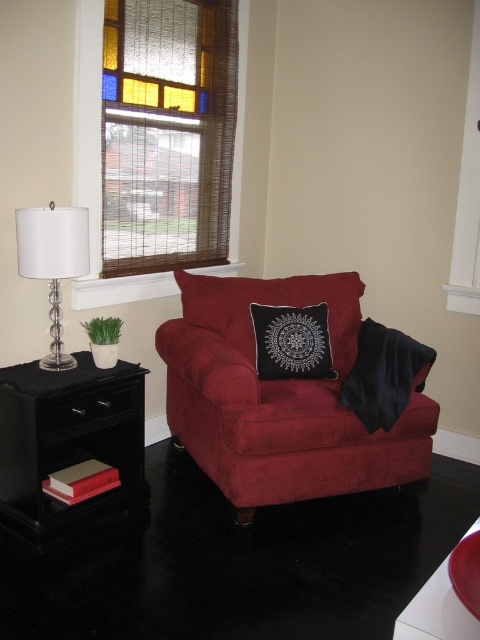
Question: Can you confirm if clear glass lamp at left is bigger than red glossy bowl at lower right?

Choices:
 (A) no
 (B) yes

Answer: (B)

Question: Does black wood side table at left appear over clear glass lamp at left?

Choices:
 (A) yes
 (B) no

Answer: (B)

Question: Which of these objects is positioned farthest from the black velvet pillow at center?

Choices:
 (A) red glossy bowl at lower right
 (B) clear glass lamp at left
 (C) stained glass window at upper left

Answer: (A)

Question: Which of the following is the closest to the observer?

Choices:
 (A) black velvet pillow at center
 (B) clear glass lamp at left
 (C) black wood side table at left
 (D) stained glass window at upper left

Answer: (C)

Question: Is black wood side table at left to the left of red glossy bowl at lower right from the viewer's perspective?

Choices:
 (A) yes
 (B) no

Answer: (A)

Question: Which is nearer to the black wood side table at left?

Choices:
 (A) clear glass lamp at left
 (B) black velvet pillow at center

Answer: (A)